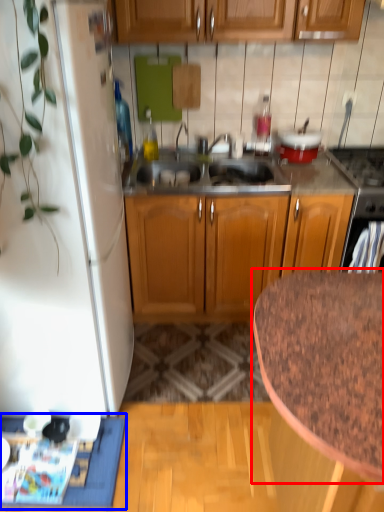
Question: Among these objects, which one is nearest to the camera, countertop (highlighted by a red box) or doormat (highlighted by a blue box)?

Choices:
 (A) countertop
 (B) doormat

Answer: (A)